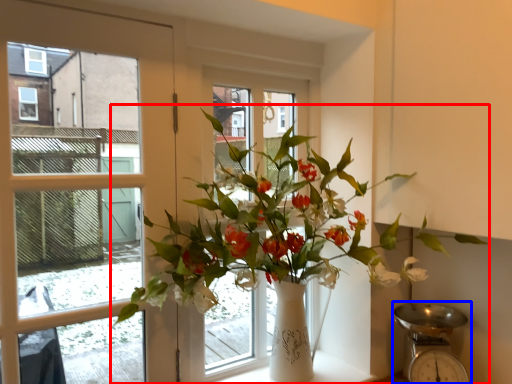
Question: Which object appears farthest to the camera in this image, houseplant (highlighted by a red box) or scale (highlighted by a blue box)?

Choices:
 (A) houseplant
 (B) scale

Answer: (B)